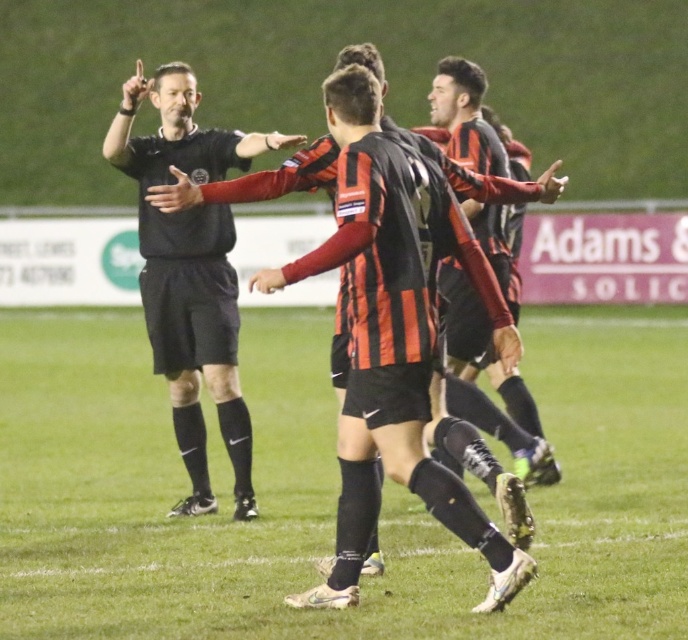
You are a soccer coach analyzing the game from the sidelines. You notice a point at coordinates (398, 333) on the field. What object does this point correspond to?

The point corresponds to the black striped jersey at center.

You are a photographer at the soccer match and want to capture a photo that includes both the black striped jersey at center and the black matte referee at center. Based on their positions, which one should be placed on the left side of the photo to ensure both are visible?

The black matte referee at center should be placed on the left side of the photo because the black striped jersey at center is positioned on the right side of the black matte referee at center.